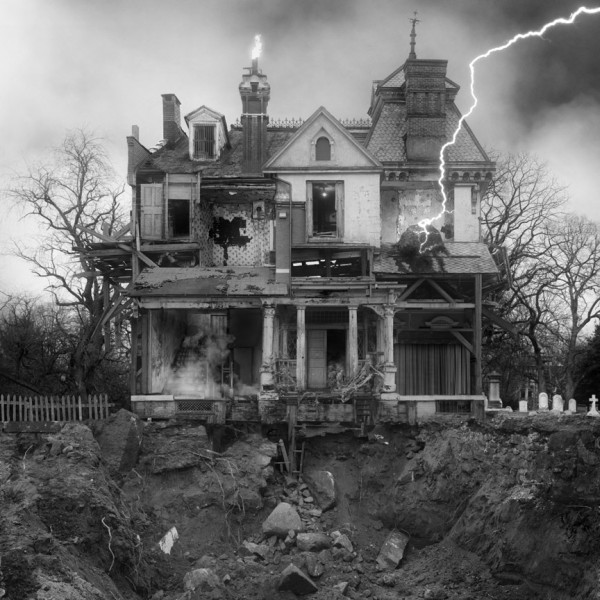
Identify the location of door. (153, 209), (308, 360).